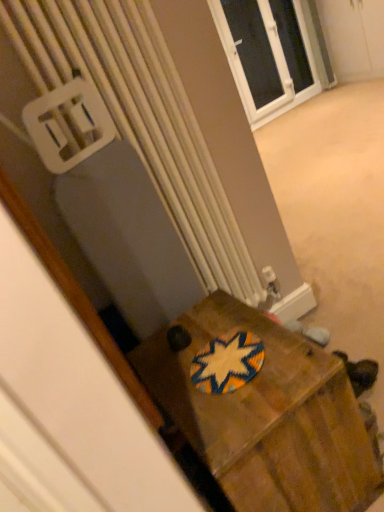
Where is `vacant space underneath white plastic window at upper center (from a real-world perspective)`? vacant space underneath white plastic window at upper center (from a real-world perspective) is located at coordinates (269, 110).